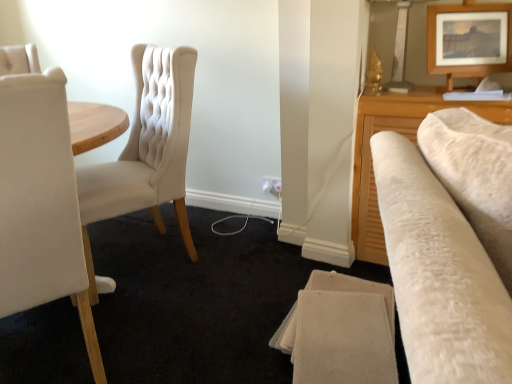
Question: Is white leather chair at left, the 2th chair when ordered from back to front, bigger or smaller than matte cream fabric chair at left, the 2th chair when ordered from front to back?

Choices:
 (A) big
 (B) small

Answer: (B)

Question: Considering the positions of point (30, 196) and point (115, 200), is point (30, 196) closer or farther from the camera than point (115, 200)?

Choices:
 (A) closer
 (B) farther

Answer: (A)

Question: Which object is positioned closest to the white leather chair at left, placed as the first chair when sorted from front to back?

Choices:
 (A) wooden picture frame at upper right
 (B) white plastic electric outlet at lower center
 (C) matte cream fabric chair at left, the 2th chair when ordered from front to back

Answer: (C)

Question: Which object is the closest to the white plastic electric outlet at lower center?

Choices:
 (A) wooden picture frame at upper right
 (B) matte cream fabric chair at left, the 2th chair when ordered from front to back
 (C) white leather chair at left, placed as the first chair when sorted from front to back

Answer: (B)